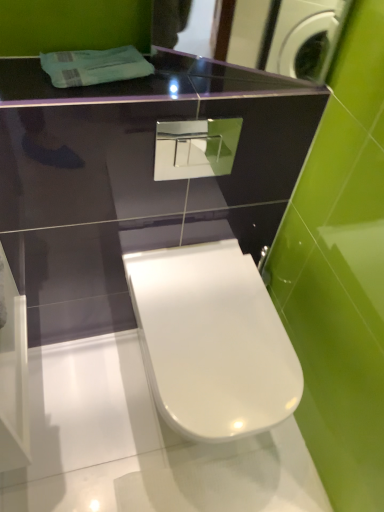
Question: Is glossy black mirror at upper center beside white glossy toilet at center?

Choices:
 (A) yes
 (B) no

Answer: (B)

Question: Can you confirm if glossy black mirror at upper center is shorter than white glossy toilet at center?

Choices:
 (A) yes
 (B) no

Answer: (A)

Question: Is glossy black mirror at upper center to the left of white glossy toilet at center from the viewer's perspective?

Choices:
 (A) no
 (B) yes

Answer: (A)

Question: Is glossy black mirror at upper center at the right side of white glossy toilet at center?

Choices:
 (A) yes
 (B) no

Answer: (A)

Question: Does glossy black mirror at upper center come in front of white glossy toilet at center?

Choices:
 (A) no
 (B) yes

Answer: (B)

Question: Is glossy black mirror at upper center positioned far away from white glossy toilet at center?

Choices:
 (A) yes
 (B) no

Answer: (A)

Question: Is white glossy toilet at center oriented towards glossy black mirror at upper center?

Choices:
 (A) yes
 (B) no

Answer: (B)

Question: Is the position of white glossy toilet at center less distant than that of glossy black mirror at upper center?

Choices:
 (A) no
 (B) yes

Answer: (A)

Question: From a real-world perspective, is white glossy toilet at center positioned over glossy black mirror at upper center based on gravity?

Choices:
 (A) no
 (B) yes

Answer: (A)

Question: Considering the relative sizes of white glossy toilet at center and glossy black mirror at upper center in the image provided, is white glossy toilet at center thinner than glossy black mirror at upper center?

Choices:
 (A) yes
 (B) no

Answer: (B)

Question: From the image's perspective, would you say white glossy toilet at center is shown under glossy black mirror at upper center?

Choices:
 (A) yes
 (B) no

Answer: (A)

Question: Is white glossy toilet at center to the left of glossy black mirror at upper center from the viewer's perspective?

Choices:
 (A) yes
 (B) no

Answer: (A)

Question: Considering the positions of white glossy toilet at center and glossy black mirror at upper center in the image, is white glossy toilet at center bigger or smaller than glossy black mirror at upper center?

Choices:
 (A) big
 (B) small

Answer: (A)